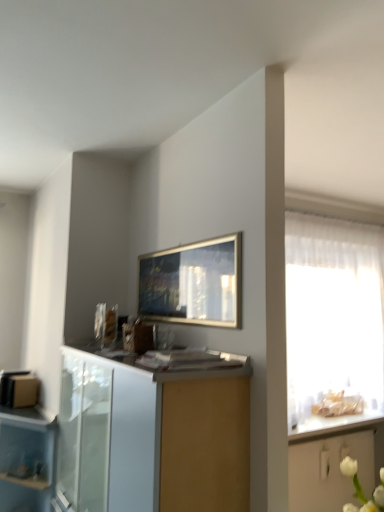
Question: From the image's perspective, is translucent fabric at right above or below white glossy countertop at right?

Choices:
 (A) above
 (B) below

Answer: (A)

Question: From a real-world perspective, is translucent fabric at right above or below white glossy countertop at right?

Choices:
 (A) below
 (B) above

Answer: (B)

Question: Estimate the real-world distances between objects in this image. Which object is farther from the white glossy cabinet at lower center, the second cabinetry from the back?

Choices:
 (A) transparent plastic drawer at lower left
 (B) translucent fabric at right
 (C) white glossy countertop at right
 (D) white glossy cabinet at lower right, marked as the second cabinetry in a top-to-bottom arrangement

Answer: (B)

Question: Based on their relative distances, which object is nearer to the white glossy cabinet at lower right, which ranks as the first cabinetry in right-to-left order?

Choices:
 (A) white glossy cabinet at lower center, which appears as the 1th cabinetry when viewed from the front
 (B) transparent plastic drawer at lower left
 (C) translucent fabric at right
 (D) white glossy countertop at right

Answer: (D)